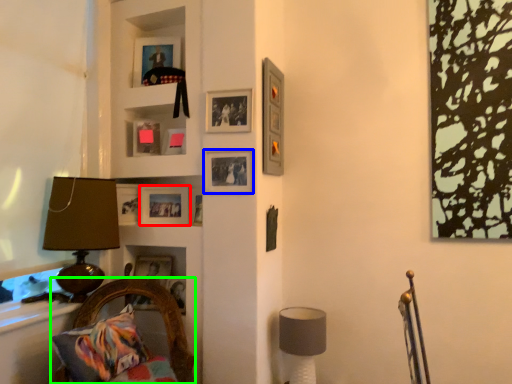
Question: Which object is positioned closest to picture frame (highlighted by a red box)? Select from picture frame (highlighted by a blue box) and furniture (highlighted by a green box).

Choices:
 (A) picture frame
 (B) furniture

Answer: (A)